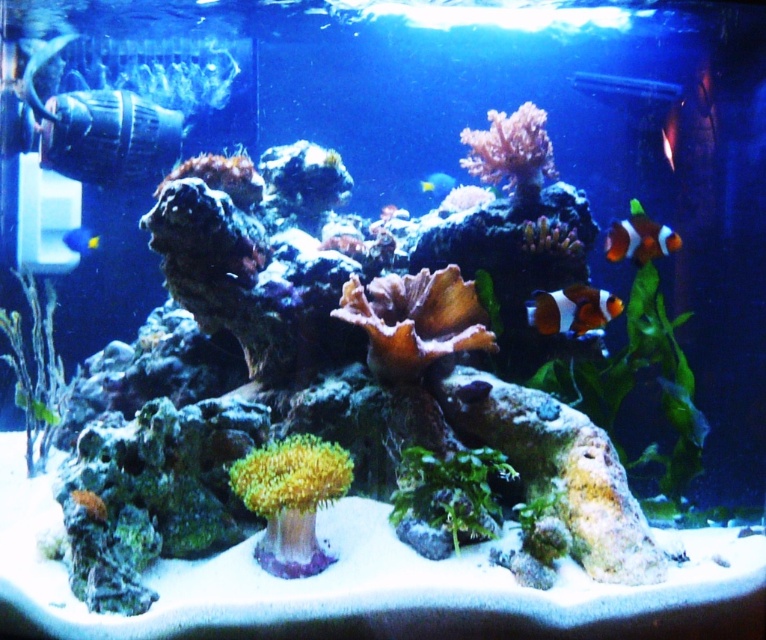
You are an underwater photographer aiming to capture the green matte coral at center and the translucent yellow fish at center in a single shot. Based on their positions, will the fish appear above or below the coral in your photo?

The green matte coral at center is positioned under the translucent yellow fish at center, so the fish will appear above the coral in the photo.

You are standing in front of an aquarium and notice a point marked at coordinates point (x=632, y=241). If you want to touch this point with a 10 feet long stick, will you be able to reach it?

The point (x=632, y=241) is 9.56 feet from the viewer. Since the stick is 10 feet long, which is longer than the distance to the point, you can reach it with the stick.

You are an aquarium maintenance worker checking the tank. You notice the orange and white striped fish at upper right and the orange coral at lower left. Which one has a bigger size?

The orange and white striped fish at upper right is larger in size than the orange coral at lower left.